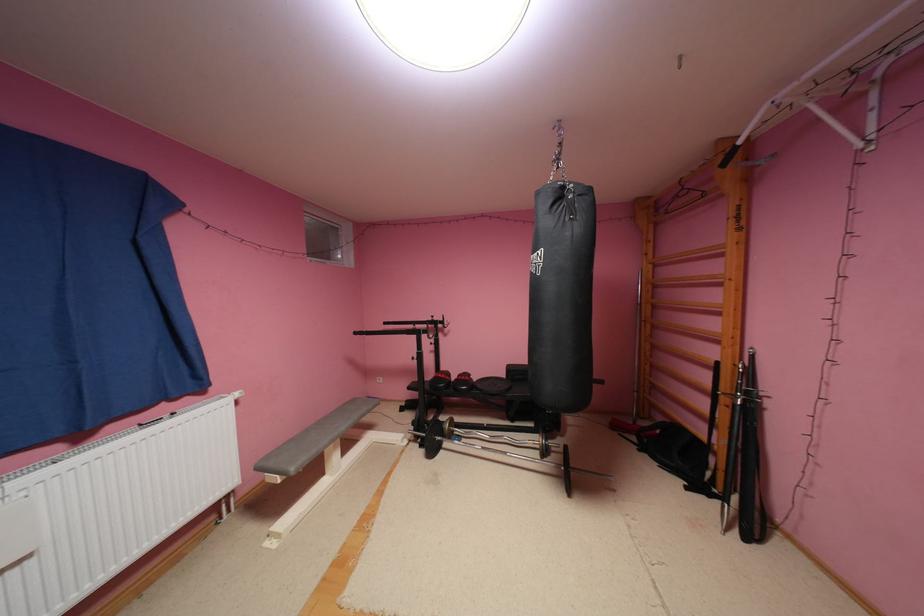
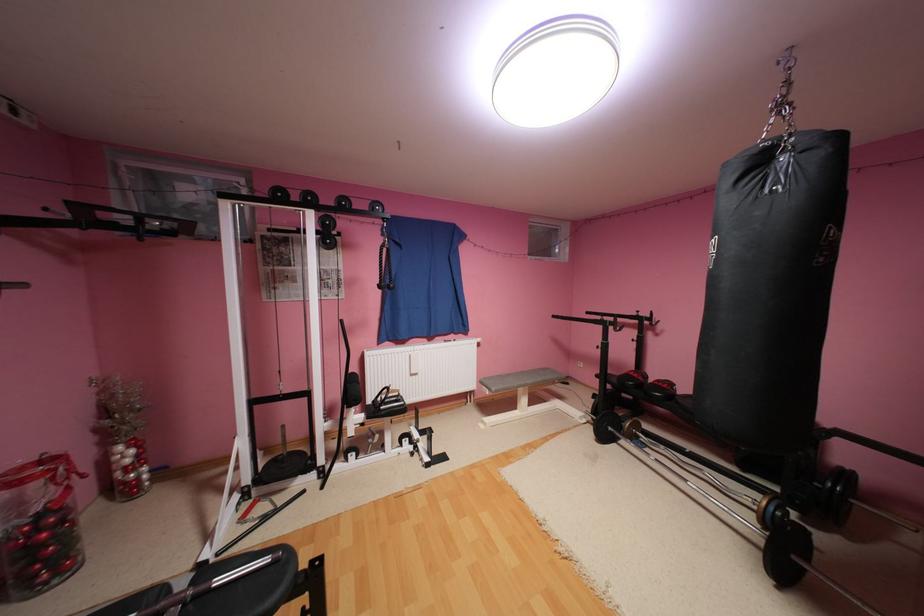
Question: The camera is either moving clockwise (left) or counter-clockwise (right) around the object. The first image is from the beginning of the video and the second image is from the end. Is the camera moving left or right when shooting the video?

Choices:
 (A) Left
 (B) Right

Answer: (B)